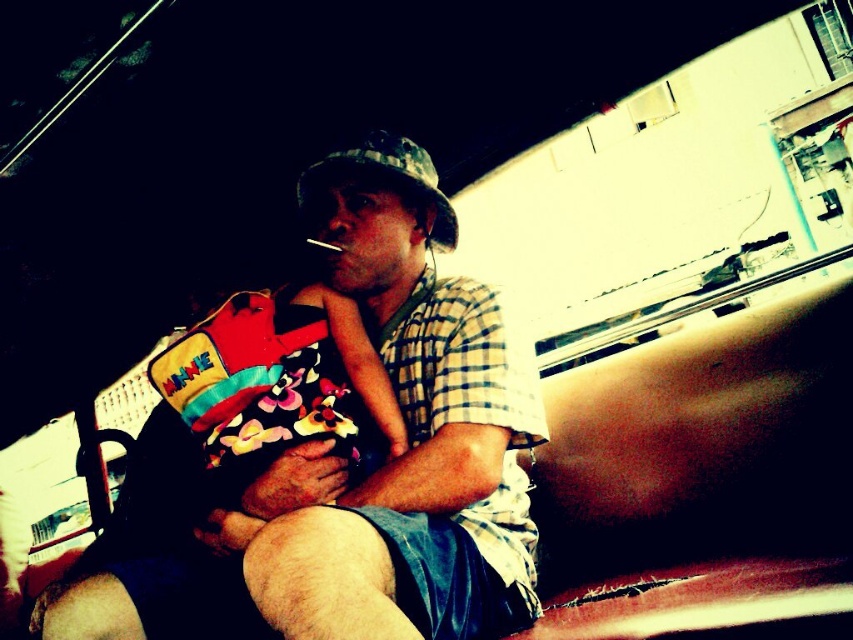
Where is the matte plaid shirt at center located in the image?

The matte plaid shirt at center is located at point [351,458].

You are a photographer trying to capture a candid shot of the man and the child. You want to focus on the point at coordinate point (351,458). According to the scene description, where exactly is this point located on the man?

The point at coordinate point (351,458) is located on the matte plaid shirt at center, which is part of the man.

You are a photographer trying to capture a closeup shot of the matte plaid shirt at center and the camouflage fabric baseball hat at center. Since you want to focus on both items clearly, which one should you zoom in on more to ensure the smaller object remains in focus?

The camouflage fabric baseball hat at center is smaller than the matte plaid shirt at center. To ensure both are in focus, you should zoom in more on the smaller camouflage fabric baseball hat at center so its details are clear while the larger matte plaid shirt at center remains in frame.